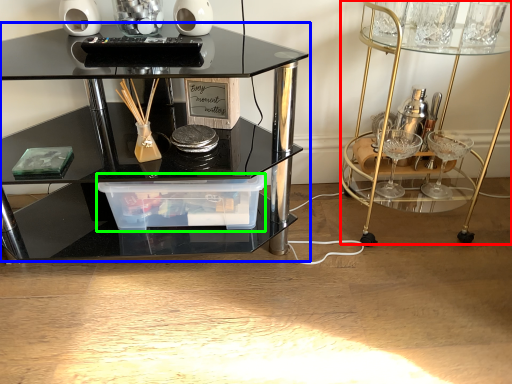
Question: Considering the real-world distances, which object is closest to vanity (highlighted by a red box)? table (highlighted by a blue box) or glass box (highlighted by a green box).

Choices:
 (A) table
 (B) glass box

Answer: (B)